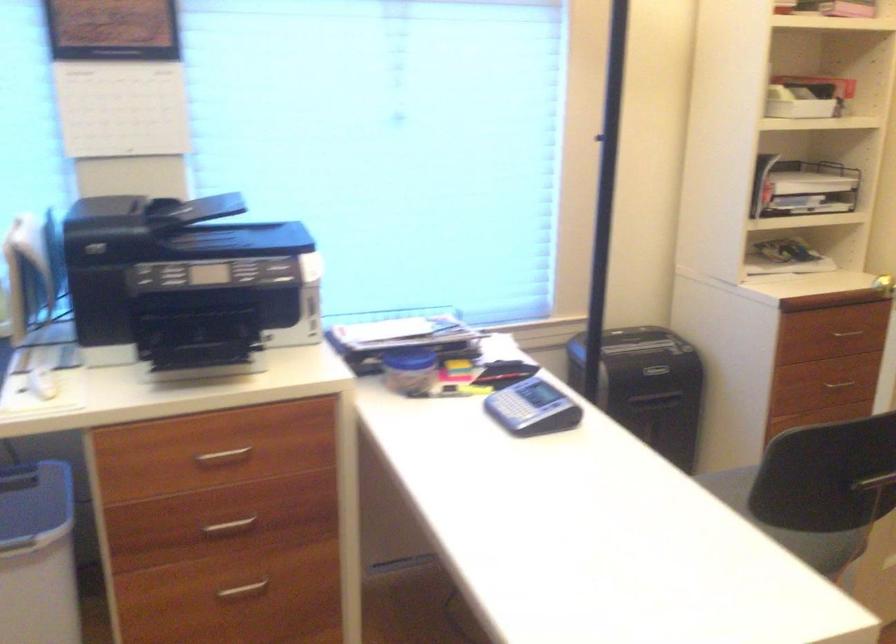
Describe the element at coordinates (193, 303) in the screenshot. The image size is (896, 644). I see `the black paper tray` at that location.